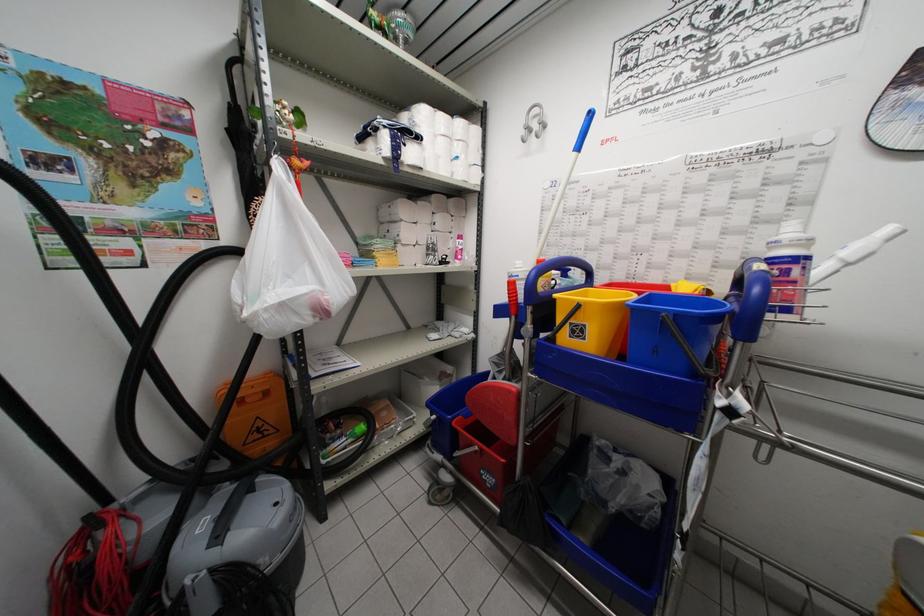
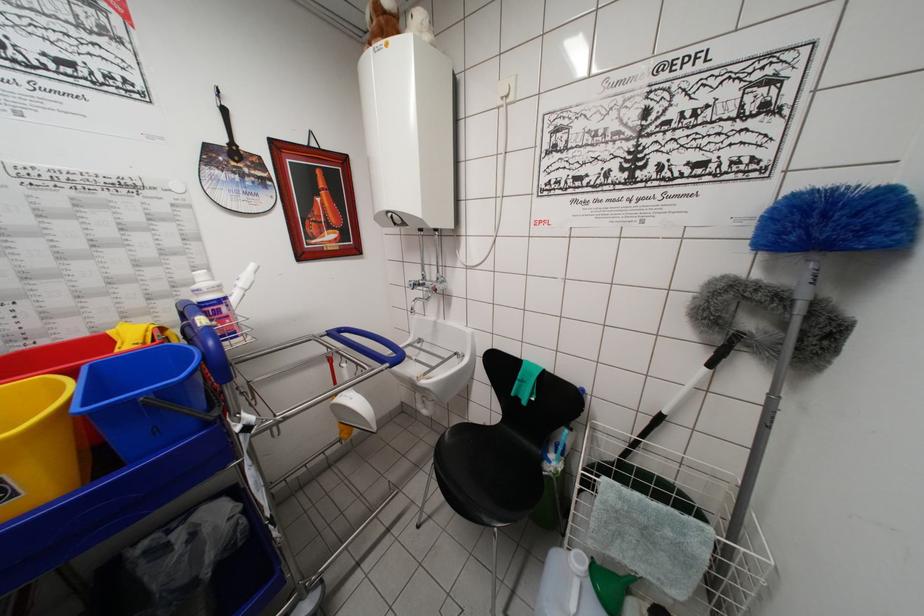
In the second image, find the point that corresponds to pixel 589 344 in the first image.

(20, 500)